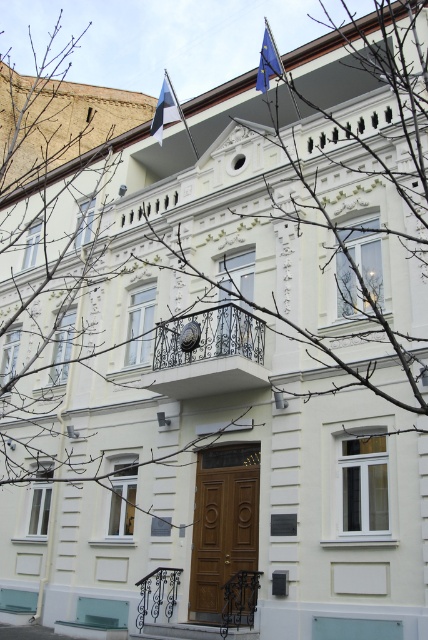
Question: Does blue and white striped flag at upper center have a greater width compared to blue fabric flag at upper center?

Choices:
 (A) no
 (B) yes

Answer: (B)

Question: Does blue and white striped flag at upper center have a smaller size compared to blue fabric flag at upper center?

Choices:
 (A) yes
 (B) no

Answer: (B)

Question: Is blue and white striped flag at upper center below blue fabric flag at upper center?

Choices:
 (A) yes
 (B) no

Answer: (A)

Question: Which point is farther to the camera?

Choices:
 (A) (267, 29)
 (B) (169, 115)

Answer: (A)